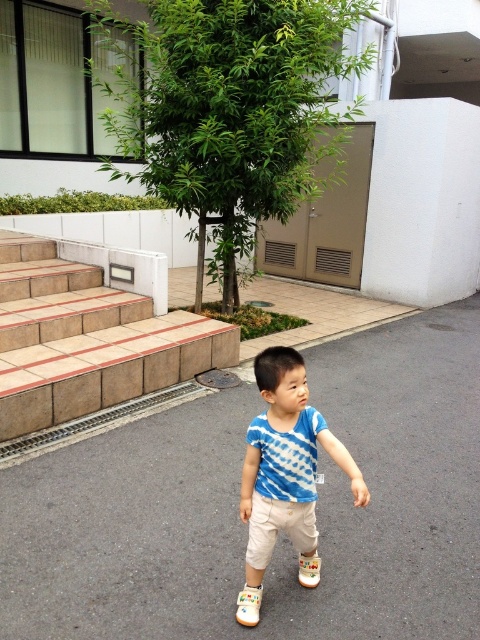
You are standing at the position of the child in the image and want to walk towards the building. Which point, point (244, 588) or point (320, 570), should you head towards to reach the building faster?

You should head towards point (244, 588) because it is closer to the viewer and therefore closer to the building than point (320, 570).